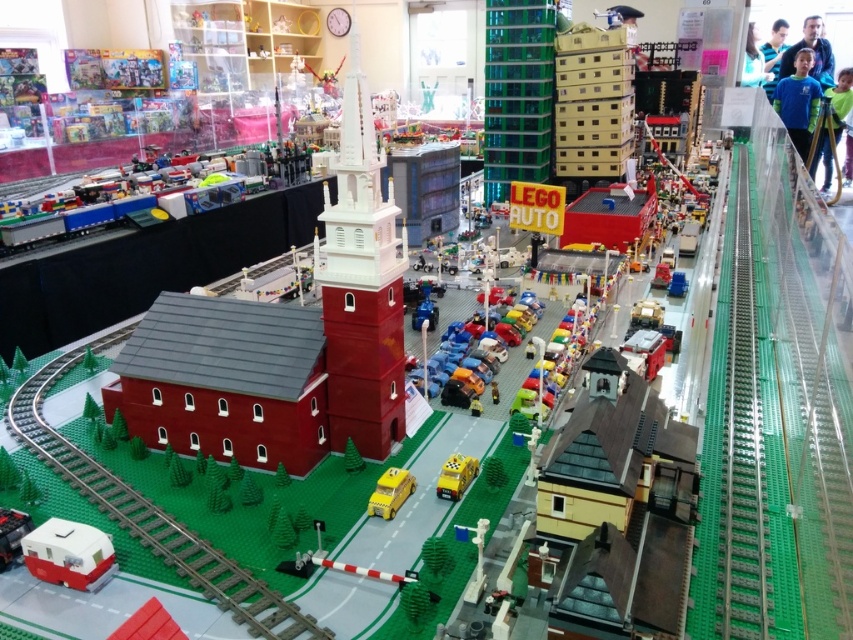
Question: From the image, what is the correct spatial relationship of shiny plastic cars at center in relation to yellow plastic taxi at center?

Choices:
 (A) right
 (B) left

Answer: (A)

Question: Where is shiny plastic cars at center located in relation to yellow plastic taxi at center in the image?

Choices:
 (A) below
 (B) above

Answer: (B)

Question: Among these points, which one is farthest from the camera?

Choices:
 (A) (106, 536)
 (B) (447, 316)
 (C) (454, 464)

Answer: (B)

Question: Can you confirm if white matte camper at lower left is positioned to the right of yellow matte taxi at center?

Choices:
 (A) no
 (B) yes

Answer: (A)

Question: Which object is closer to the camera taking this photo?

Choices:
 (A) white matte camper at lower left
 (B) shiny plastic cars at center
 (C) yellow plastic taxi at center

Answer: (A)

Question: Which of these objects is positioned farthest from the shiny plastic cars at center?

Choices:
 (A) matte red church at left
 (B) yellow plastic taxi at center
 (C) white matte camper at lower left
 (D) yellow matte taxi at center

Answer: (C)